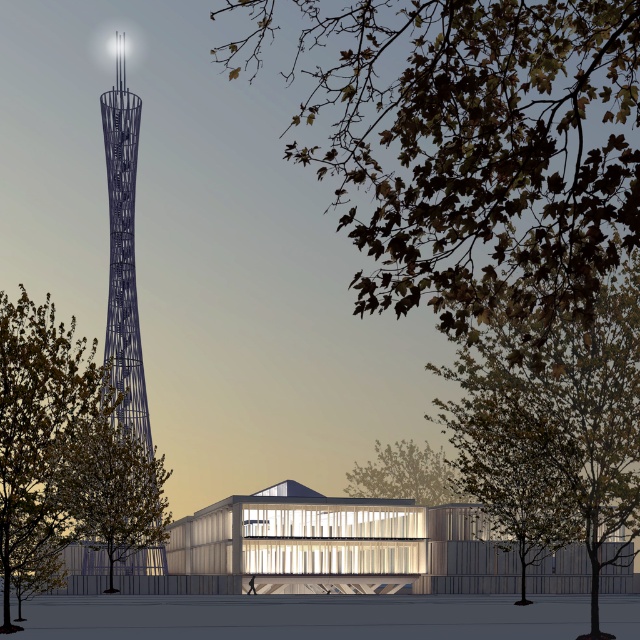
Question: Which object is farther from the camera taking this photo?

Choices:
 (A) metallic lattice tower at left
 (B) green leafy tree at right

Answer: (A)

Question: Is green leafy branches at upper right positioned behind green leafy tree at right?

Choices:
 (A) no
 (B) yes

Answer: (A)

Question: Does green leafy tree at left have a lesser width compared to brown leafy tree at left?

Choices:
 (A) yes
 (B) no

Answer: (B)

Question: Which point is farther to the camera?

Choices:
 (A) green leafy tree at right
 (B) green leafy branches at upper right
 (C) green leafy tree at left
 (D) brown leafy tree at left

Answer: (D)

Question: Is brown leafy tree at left further to the viewer compared to metallic lattice tower at left?

Choices:
 (A) no
 (B) yes

Answer: (A)

Question: Which point is closer to the camera taking this photo?

Choices:
 (A) (49, 381)
 (B) (376, 484)

Answer: (A)